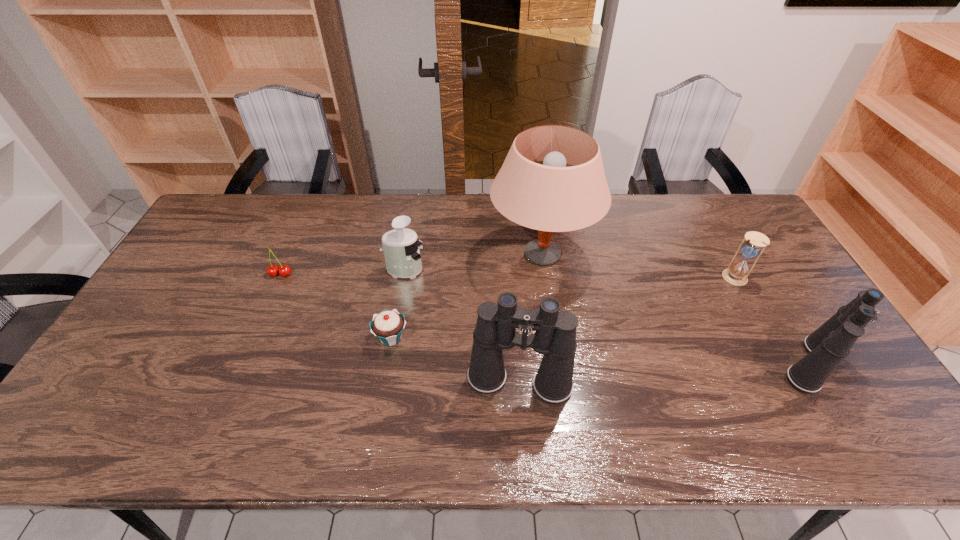
Please point out where to position a new binoculars on the left to maintain spacing. Please provide its 2D coordinates. Your answer should be formatted as a tuple, i.e. [(x, y)], where the tuple contains the x and y coordinates of a point satisfying the conditions above.

[(208, 401)]